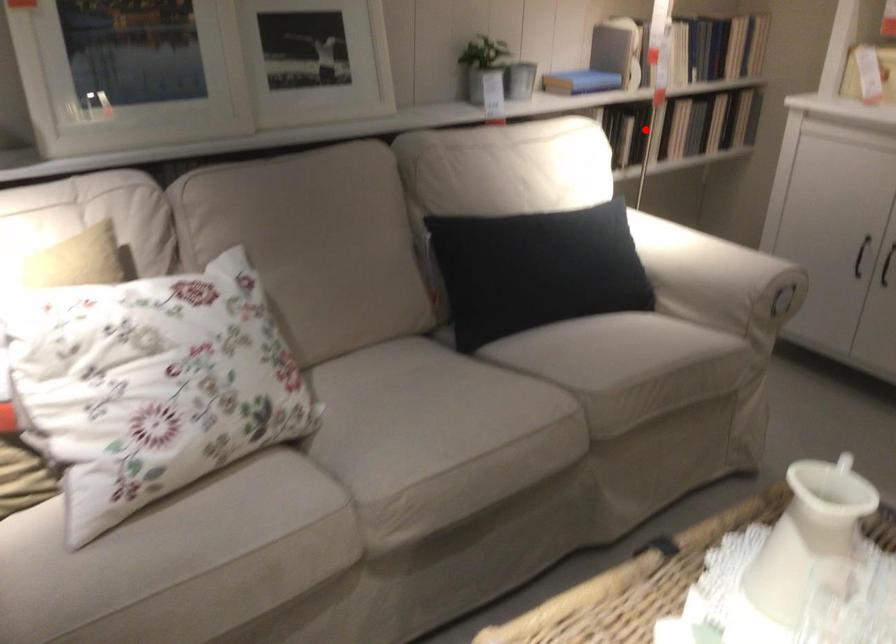
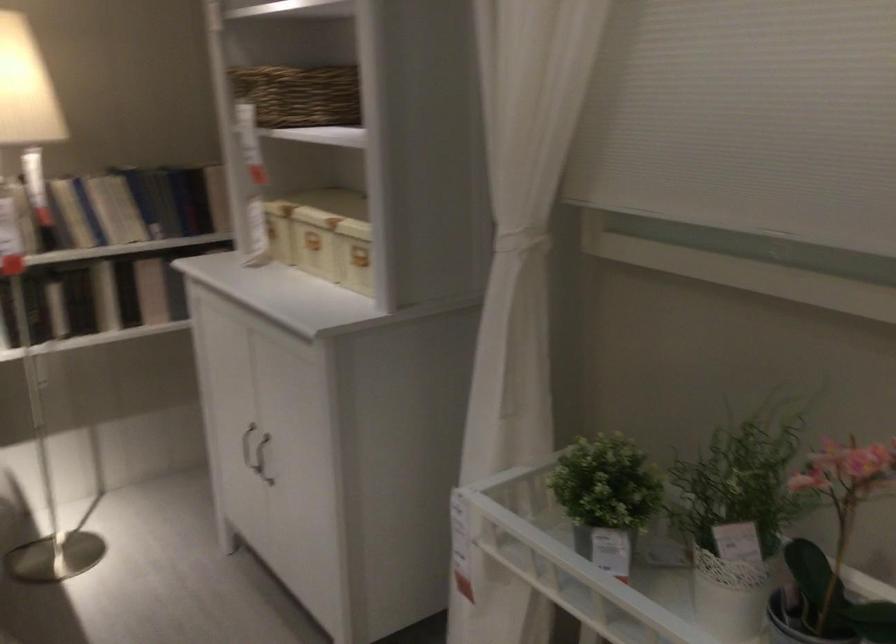
Locate, in the second image, the point that corresponds to the highlighted location in the first image.

(55, 307)